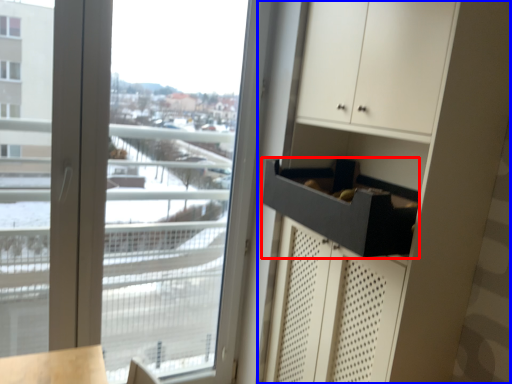
Question: Which object appears farthest to the camera in this image, drawer (highlighted by a red box) or dresser (highlighted by a blue box)?

Choices:
 (A) drawer
 (B) dresser

Answer: (A)